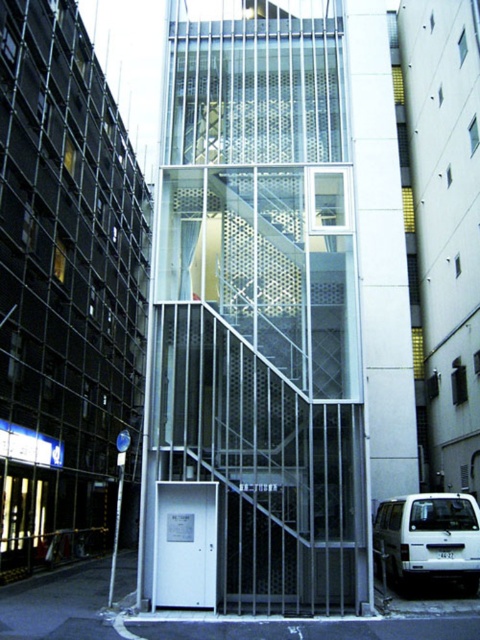
Find the location of a particular element. transparent glass elevator at center is located at coordinates (255, 323).

Between transparent glass elevator at center and white matte suv at lower right, which one is positioned lower?

Positioned lower is white matte suv at lower right.

This screenshot has width=480, height=640. I want to click on transparent glass elevator at center, so click(x=255, y=323).

Locate an element on the screen. The width and height of the screenshot is (480, 640). transparent glass elevator at center is located at coordinates (255, 323).